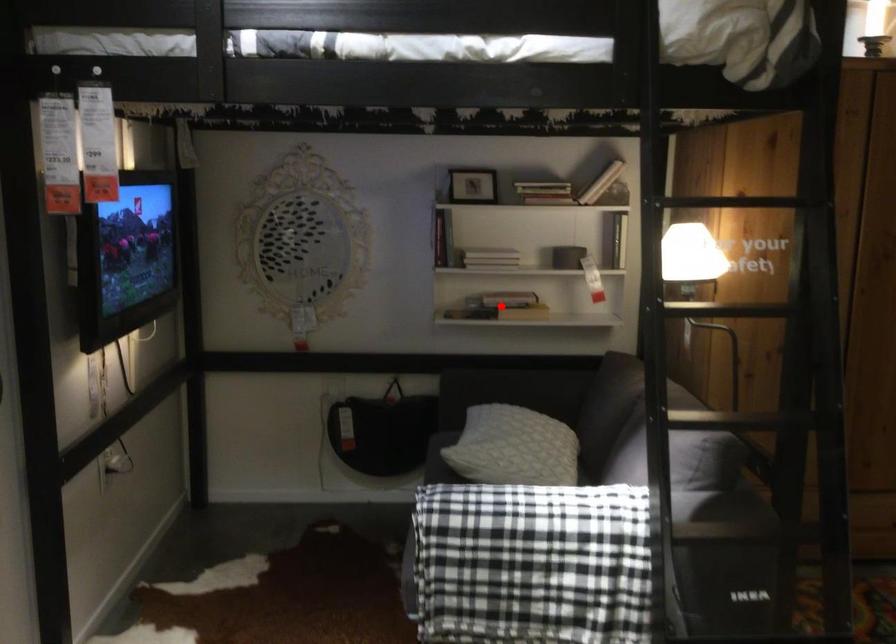
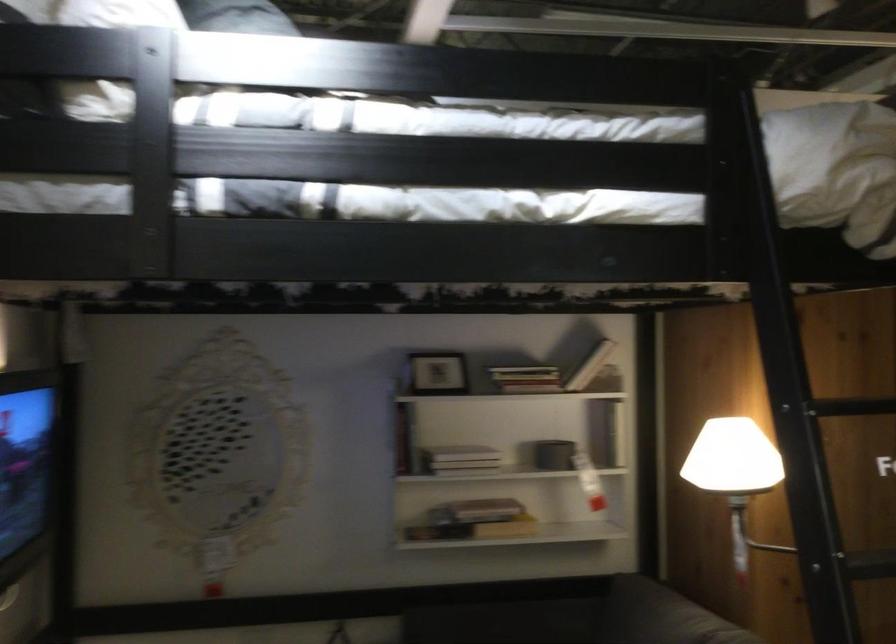
Locate, in the second image, the point that corresponds to the highlighted location in the first image.

(474, 529)